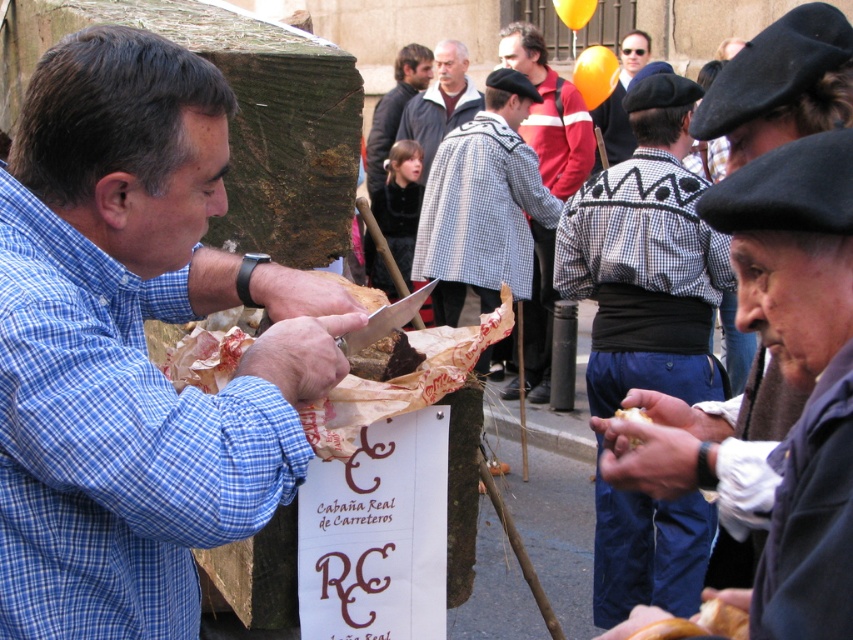
Question: Is shiny brown paper at center wider than matte black beret at upper center?

Choices:
 (A) no
 (B) yes

Answer: (A)

Question: Which point is farther to the camera?

Choices:
 (A) checkered fabric jacket at center
 (B) checkered wool coat at center
 (C) golden brown bread at lower right
 (D) gray wool coat at center

Answer: (D)

Question: Among these points, which one is farthest from the camera?

Choices:
 (A) [631, 410]
 (B) [426, 116]

Answer: (B)

Question: Is checkered wool coat at center wider than golden brown bread at lower right?

Choices:
 (A) no
 (B) yes

Answer: (B)

Question: Which point appears closest to the camera in this image?

Choices:
 (A) (509, 272)
 (B) (531, 365)

Answer: (A)

Question: Is blue plaid shirt at left positioned in front of matte black beret at upper center?

Choices:
 (A) yes
 (B) no

Answer: (A)